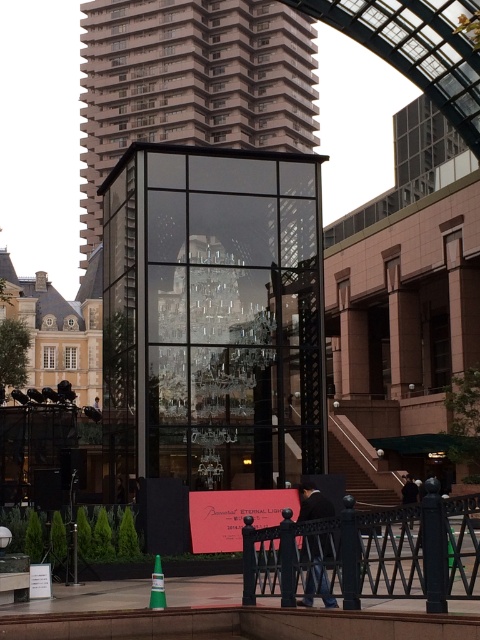
You are standing in the urban setting and want to determine the relative positions of two points marked in the image. Which point is closer to you, point [257,104] or point [158,593]?

Point [257,104] is further to the viewer than point [158,593], so point [158,593] is closer to you.

You are a city planner assessing the layout of this area. You need to install a new security camera that can cover both the black metal fence at lower center and the matte red sign at center. Given that the camera has a limited field of view, which object should be prioritized to ensure it is fully within the camera frame?

The matte red sign at center should be prioritized because the black metal fence at lower center is larger in size than the matte red sign at center, so the fence may require a wider angle or separate coverage to be fully captured.

You are standing on the paved area near the green plastic cone at lower center. Looking up, do you see the transparent glass tower at center above you?

Yes, the transparent glass tower at center is located above the green plastic cone at lower center, so when standing near the green plastic cone at lower center and looking up, you would see the transparent glass tower at center above you.